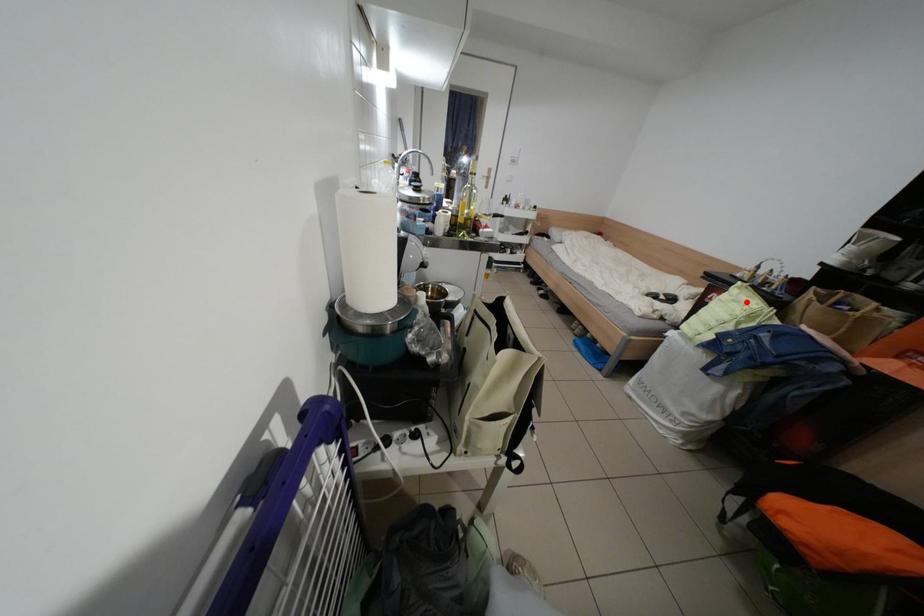
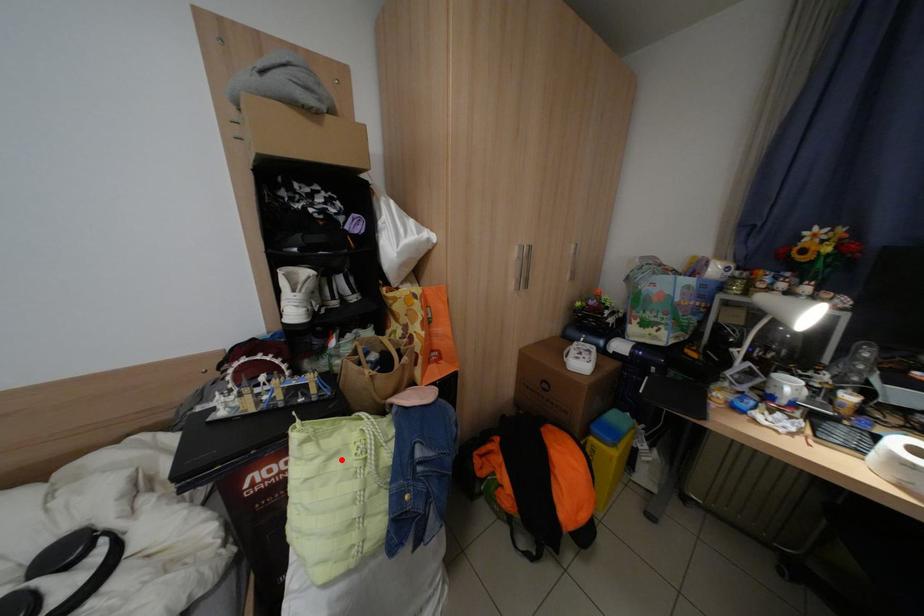
I am providing you with two images of the same scene from different viewpoints. A red point is marked on the first image and another point is marked on the second image. Is the red point in image1 aligned with the point shown in image2?

Yes